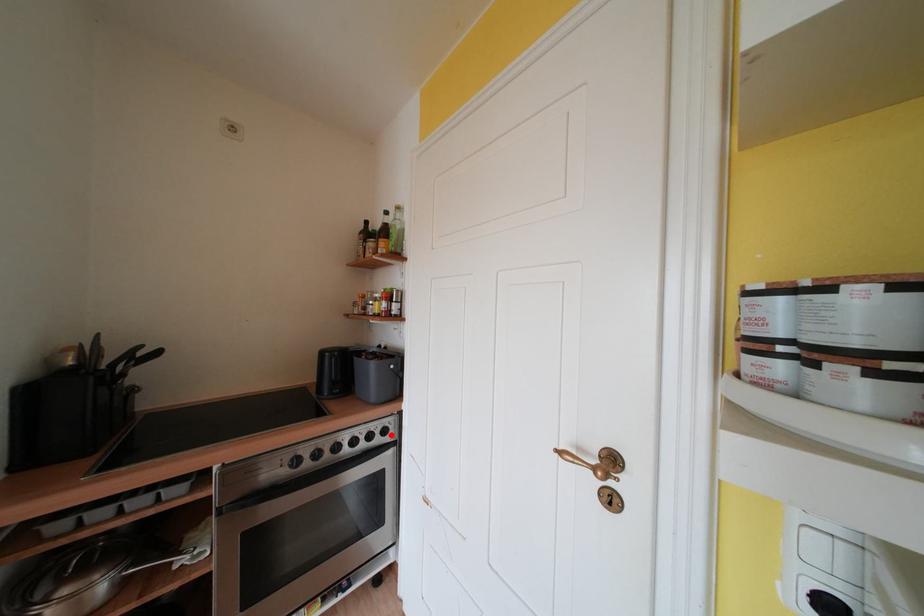
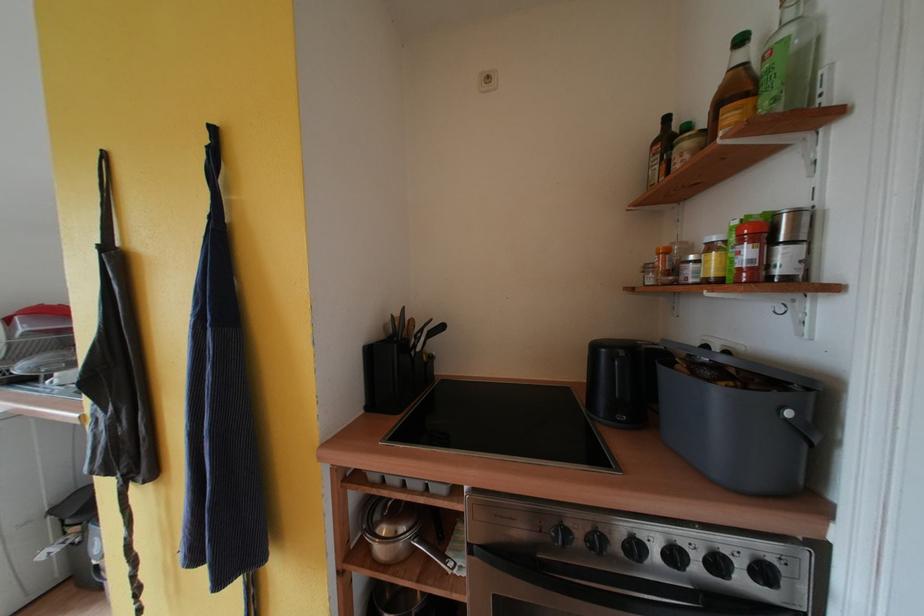
Locate, in the second image, the point that corresponds to the highlighted location in the first image.

(771, 577)